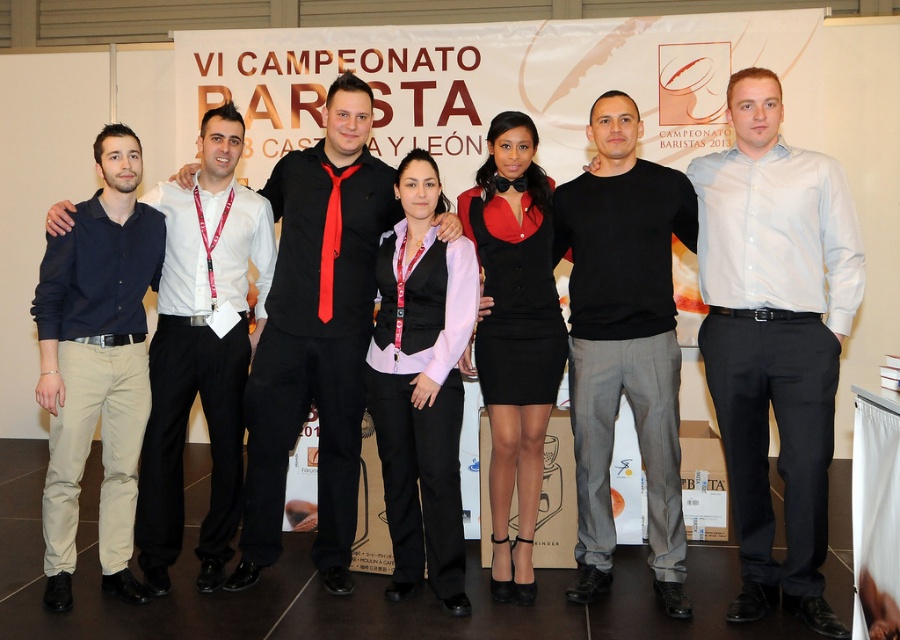
You are a photographer at the event and want to adjust the lighting so that the black matte sweater at center and the navy blue shirt at left are equally illuminated. Which direction should you move the light source to achieve this?

The black matte sweater at center is positioned on the right side of navy blue shirt at left. To equally illuminate both, move the light source to the right of the navy blue shirt at left and left of the black matte sweater at center.